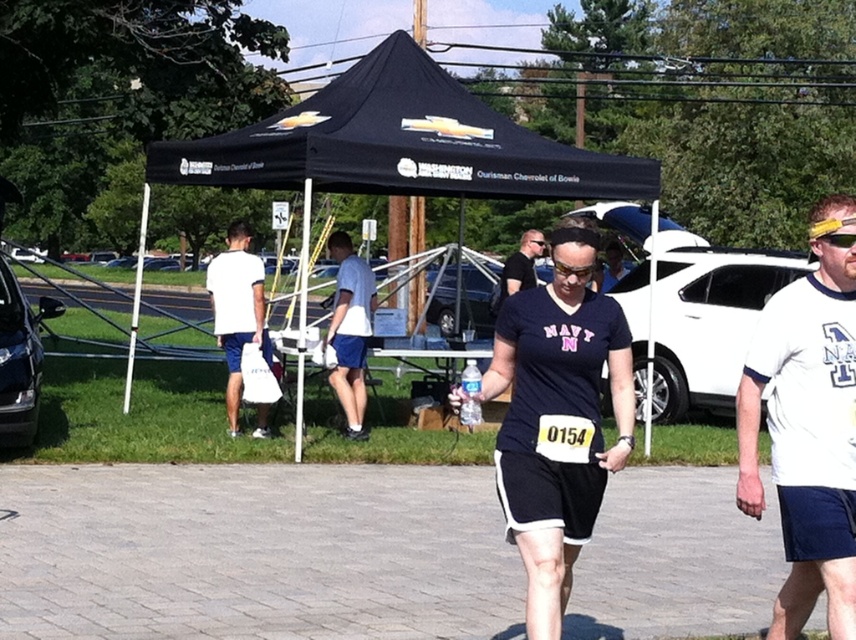
Between white cotton shirt at right and white matte bag at left, which one has more height?

Standing taller between the two is white cotton shirt at right.

Who is higher up, white cotton shirt at right or white matte bag at left?

white matte bag at left is higher up.

Is point (794, 380) more distant than point (259, 404)?

No.

This screenshot has width=856, height=640. Find the location of `white cotton shirt at right`. white cotton shirt at right is located at coordinates (807, 426).

Can you confirm if navy matte t-shirt at center is wider than white cotton shirt at right?

Indeed, navy matte t-shirt at center has a greater width compared to white cotton shirt at right.

Who is taller, navy matte t-shirt at center or white cotton shirt at right?

navy matte t-shirt at center

Between point (502, 452) and point (742, 500), which one is positioned in front?

Point (742, 500) is more forward.

The height and width of the screenshot is (640, 856). What are the coordinates of `navy matte t-shirt at center` in the screenshot? It's located at (557, 419).

Between point (271, 627) and point (526, 324), which one is positioned in front?

Point (526, 324) is in front.

Who is lower down, gray concrete pavement at center or navy matte t-shirt at center?

gray concrete pavement at center is lower down.

This screenshot has height=640, width=856. What are the coordinates of `gray concrete pavement at center` in the screenshot? It's located at (254, 554).

Locate an element on the screen. This screenshot has width=856, height=640. gray concrete pavement at center is located at coordinates (254, 554).